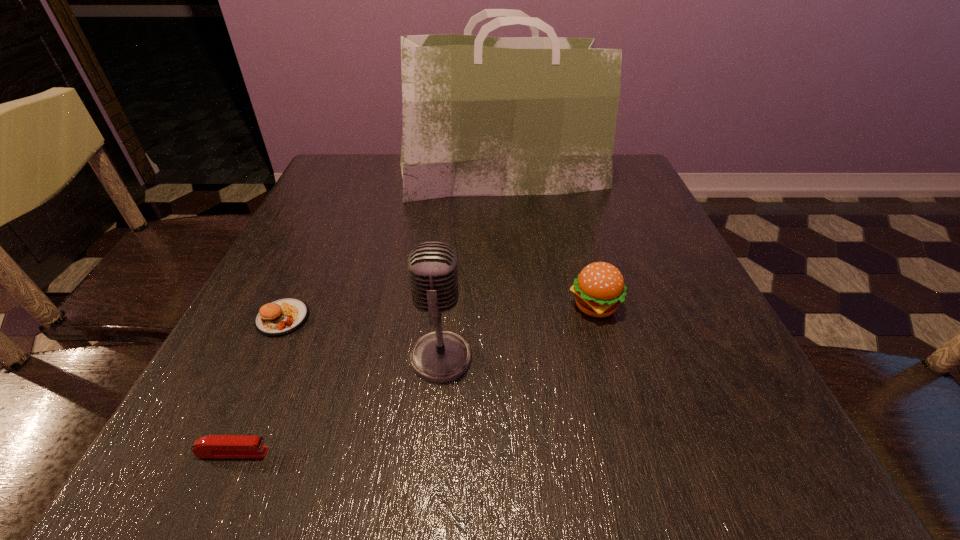
You are a GUI agent. You are given a task and a screenshot of the screen. Output one action in this format:
    pyautogui.click(x=<x>, y=<y>)
    Task: Click on the free region at the left edge of the desktop
    
    Given the screenshot: What is the action you would take?
    pyautogui.click(x=294, y=258)

This screenshot has height=540, width=960. Find the location of `free region at the right edge of the desktop`. free region at the right edge of the desktop is located at coordinates (652, 386).

Locate an element on the screen. free space at the far left corner is located at coordinates (367, 186).

In the image, there is a desktop. Identify the location of vacant space at the far right corner. (642, 180).

Where is `vacant space that is in between the microphone and the stapler`? The height and width of the screenshot is (540, 960). vacant space that is in between the microphone and the stapler is located at coordinates (337, 405).

Find the location of a particular element. free space between the tallest object and the fourth shortest object is located at coordinates (471, 267).

The image size is (960, 540). What are the coordinates of `vacant area that lies between the grocery bag and the third tallest object` in the screenshot? It's located at (548, 241).

At what (x,y) coordinates should I click in order to perform the action: click on vacant space in between the hamburger and the microphone. Please return your answer as a coordinate pair (x, y). This screenshot has width=960, height=540. Looking at the image, I should click on (517, 332).

Locate an element on the screen. The height and width of the screenshot is (540, 960). unoccupied position between the shortest object and the hamburger is located at coordinates 414,380.

Image resolution: width=960 pixels, height=540 pixels. I want to click on vacant area that lies between the stapler and the farthest object, so click(368, 315).